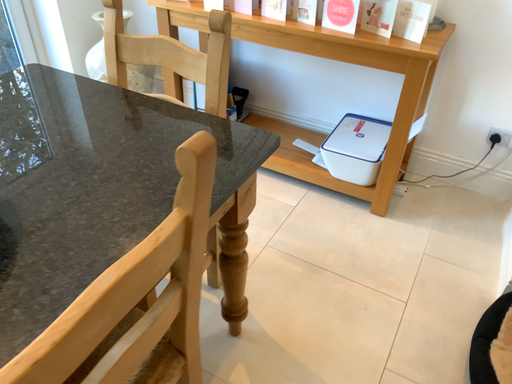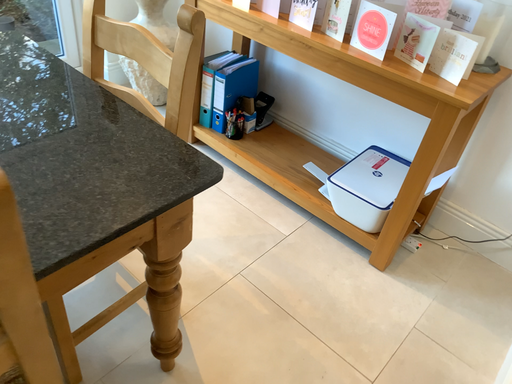
Question: Which way did the camera rotate in the video?

Choices:
 (A) rotated left
 (B) rotated right

Answer: (A)